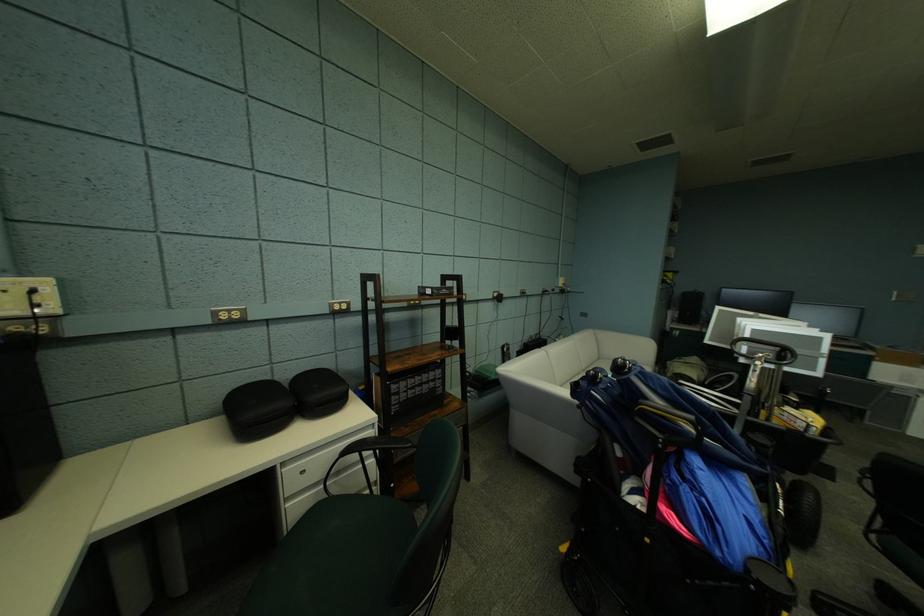
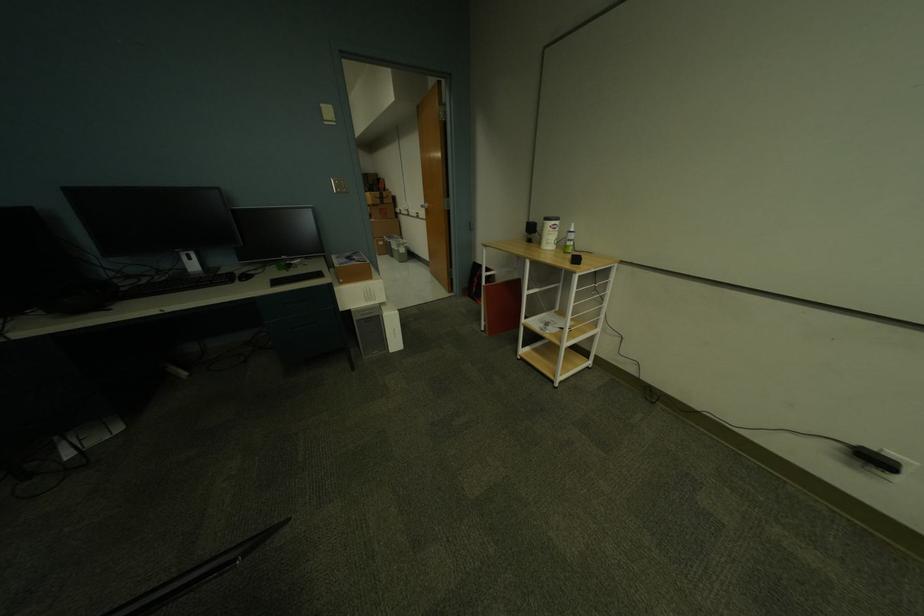
Where in the second image is the point corresponding to pixel 886 360 from the first image?

(349, 282)